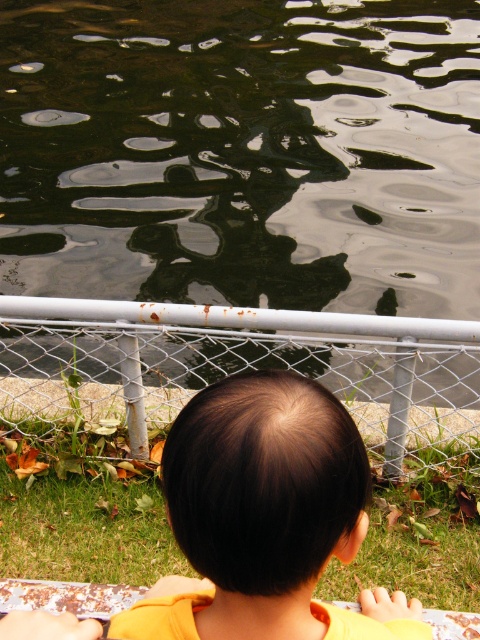
Based on the photo, can you confirm if brown hair at center is bigger than rusty metal rail at center?

Actually, brown hair at center might be smaller than rusty metal rail at center.

Does brown hair at center appear under rusty metal rail at center?

Correct, brown hair at center is located below rusty metal rail at center.

Locate an element on the screen. This screenshot has width=480, height=640. brown hair at center is located at coordinates (265, 516).

Is glossy water at upper center positioned before brown hair at center?

No, glossy water at upper center is behind brown hair at center.

Does point (156, 292) come closer to viewer compared to point (347, 538)?

No, (156, 292) is further to viewer.

Locate an element on the screen. glossy water at upper center is located at coordinates (242, 154).

Identify the location of glossy water at upper center. Image resolution: width=480 pixels, height=640 pixels. (242, 154).

The width and height of the screenshot is (480, 640). What are the coordinates of `glossy water at upper center` in the screenshot? It's located at (242, 154).